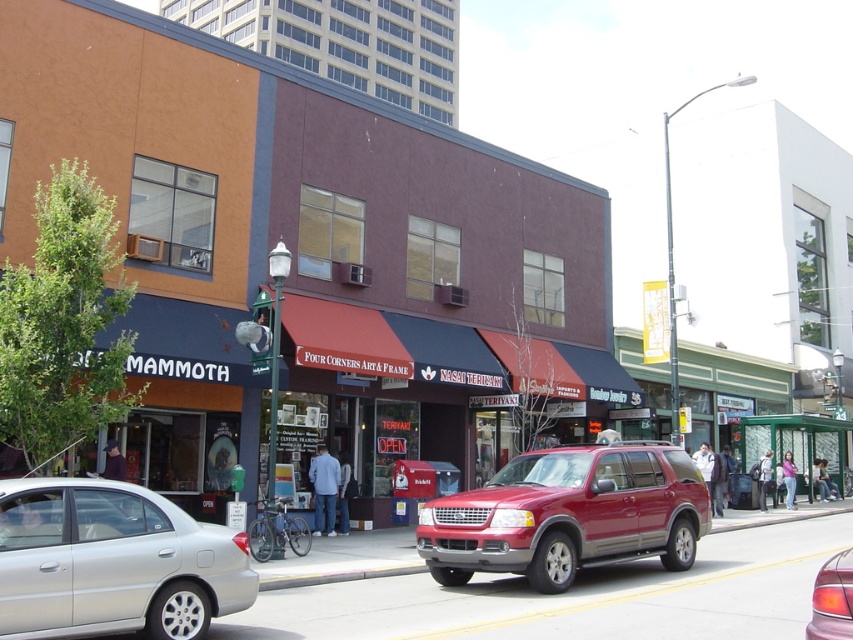
You are a pedestrian standing on the sidewalk looking at the street. You see a silver metallic sedan at lower left and a shiny red suv at center. Which vehicle is closer to the left side of the street?

The silver metallic sedan at lower left is closer to the left side of the street because it is positioned to the left of the shiny red suv at center.

You are a delivery person needing to park your 1.8 meters wide van between the silver metallic sedan at lower left and the metallic red suv at center. Can your van fit in that space?

The silver metallic sedan at lower left might be wider than metallic red suv at center, so there is uncertainty about the available space. The van may or may not fit depending on the actual width of the sedan compared to the SUV.

You are a pedestrian standing on the sidewalk. You see a shiny red suv at center and a metallic red suv at center. Which one is closer to you?

The shiny red suv at center is closer to you because the metallic red suv at center is behind it.